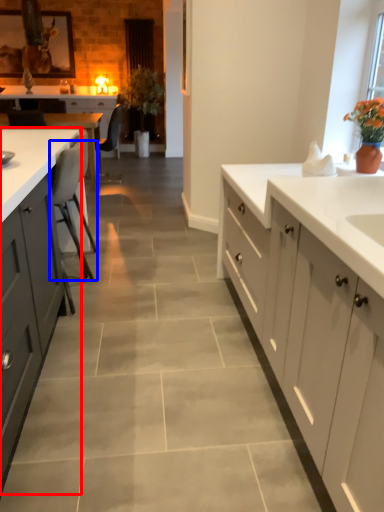
Question: Which of the following is the farthest to the observer, cabinetry (highlighted by a red box) or chair (highlighted by a blue box)?

Choices:
 (A) cabinetry
 (B) chair

Answer: (B)